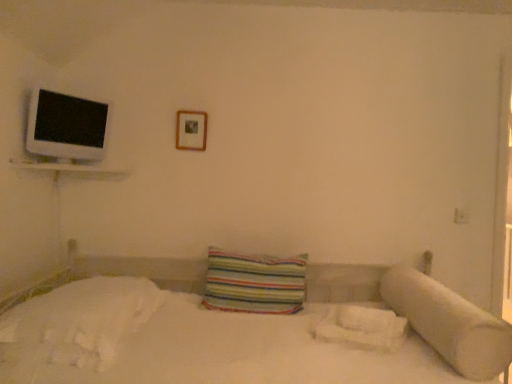
Question: In terms of height, does wooden picture frame at upper center look taller or shorter compared to white fluffy sheet at lower right, arranged as the first sheet when viewed from the right?

Choices:
 (A) tall
 (B) short

Answer: (A)

Question: Is point [199, 132] closer or farther from the camera than point [373, 319]?

Choices:
 (A) farther
 (B) closer

Answer: (A)

Question: Which object is the farthest from the white glossy flat at upper left?

Choices:
 (A) wooden picture frame at upper center
 (B) white soft pillow at right, arranged as the 1th pillow when viewed from the right
 (C) striped fabric pillow at center, the 1th pillow when ordered from left to right
 (D) white fluffy sheet at lower right, the second sheet from the left
 (E) white soft bedsheet at lower left, arranged as the 2th sheet when viewed from the right

Answer: (B)

Question: Which of these objects is positioned farthest from the wooden picture frame at upper center?

Choices:
 (A) white glossy flat at upper left
 (B) white fluffy sheet at lower right, arranged as the first sheet when viewed from the right
 (C) white soft bedsheet at lower left, arranged as the 2th sheet when viewed from the right
 (D) striped fabric pillow at center, which is the 2th pillow in right-to-left order
 (E) white soft pillow at right, the 2th pillow in the left-to-right sequence

Answer: (E)